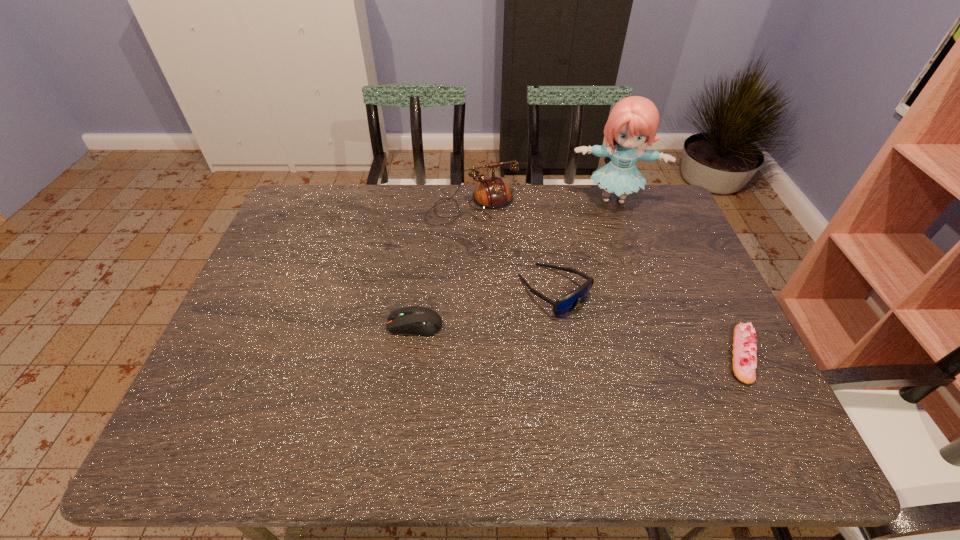
Find the location of `vacant area situated 0.220m on the front-facing side of the third shortest object`. vacant area situated 0.220m on the front-facing side of the third shortest object is located at coordinates (655, 369).

Image resolution: width=960 pixels, height=540 pixels. I want to click on vacant space located 0.130m on the front-facing side of the third shortest object, so click(623, 345).

Locate an element on the screen. Image resolution: width=960 pixels, height=540 pixels. free spot located on the front-facing side of the doll is located at coordinates (611, 226).

Image resolution: width=960 pixels, height=540 pixels. I want to click on blank space located 0.300m on the front-facing side of the doll, so click(612, 281).

You are a GUI agent. You are given a task and a screenshot of the screen. Output one action in this format:
    pyautogui.click(x=<x>, y=<y>)
    Task: Click on the vacant space situated on the front-facing side of the doll
    Image resolution: width=960 pixels, height=540 pixels.
    Given the screenshot: What is the action you would take?
    pyautogui.click(x=611, y=259)

Where is `free space located on the rotary dial of the second tallest object`? free space located on the rotary dial of the second tallest object is located at coordinates (538, 320).

Where is `vacant space located 0.140m on the rotary dial of the second tallest object`? The width and height of the screenshot is (960, 540). vacant space located 0.140m on the rotary dial of the second tallest object is located at coordinates (503, 255).

The image size is (960, 540). Identify the location of vacant point located on the rotary dial of the second tallest object. (x=514, y=274).

This screenshot has width=960, height=540. I want to click on doll located at the far edge, so click(634, 120).

This screenshot has height=540, width=960. In order to click on telephone that is at the far edge in this screenshot , I will do `click(493, 193)`.